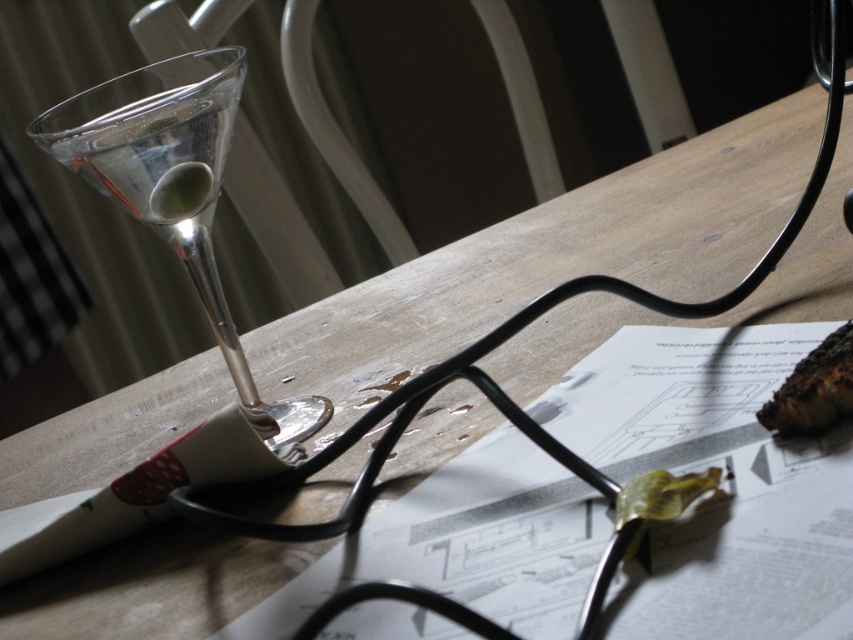
Can you confirm if white paper at center is taller than clear glass martini glass at left?

In fact, white paper at center may be shorter than clear glass martini glass at left.

Does white paper at center have a smaller size compared to clear glass martini glass at left?

Actually, white paper at center might be larger than clear glass martini glass at left.

Where is `white paper at center`? This screenshot has width=853, height=640. white paper at center is located at coordinates (721, 484).

You are a GUI agent. You are given a task and a screenshot of the screen. Output one action in this format:
    pyautogui.click(x=<x>, y=<y>)
    Task: Click on the white paper at center
    This screenshot has height=640, width=853.
    Given the screenshot: What is the action you would take?
    pyautogui.click(x=721, y=484)

Between point (293, 627) and point (821, 362), which one is positioned behind?

The point (821, 362) is behind.

Between point (569, 554) and point (834, 410), which one is positioned behind?

Positioned behind is point (834, 410).

Where is `white paper at center`? white paper at center is located at coordinates pyautogui.click(x=721, y=484).

Between point (840, 376) and point (708, 483), which one is positioned in front?

Positioned in front is point (708, 483).

Does charcoal black bread at lower right come behind green leafy vegetable at center?

Yes.

You are a GUI agent. You are given a task and a screenshot of the screen. Output one action in this format:
    pyautogui.click(x=<x>, y=<y>)
    Task: Click on the charcoal black bread at lower right
    The image size is (853, 640).
    Given the screenshot: What is the action you would take?
    pyautogui.click(x=813, y=388)